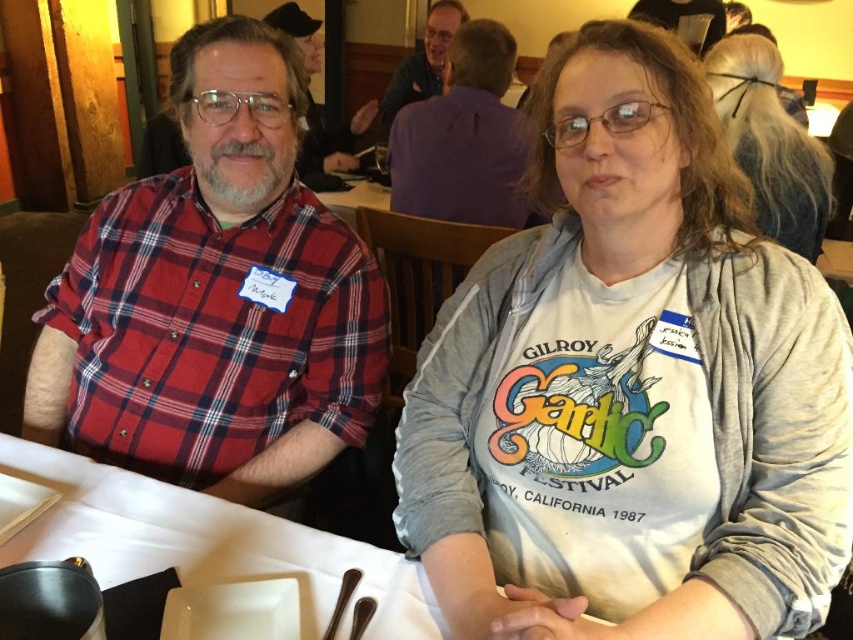
Is gray fleece jacket at upper center to the right of green fabric shirt at upper center from the viewer's perspective?

No, gray fleece jacket at upper center is not to the right of green fabric shirt at upper center.

From the picture: Between gray fleece jacket at upper center and green fabric shirt at upper center, which one appears on the left side from the viewer's perspective?

gray fleece jacket at upper center is more to the left.

The width and height of the screenshot is (853, 640). Describe the element at coordinates (331, 140) in the screenshot. I see `gray fleece jacket at upper center` at that location.

Locate an element on the screen. The height and width of the screenshot is (640, 853). gray fleece jacket at upper center is located at coordinates (331, 140).

Which of these two, white glossy plate at lower center or polished metal spoon at lower center, stands shorter?

Standing shorter between the two is polished metal spoon at lower center.

Which is more to the right, white glossy plate at lower center or polished metal spoon at lower center?

From the viewer's perspective, polished metal spoon at lower center appears more on the right side.

Find the location of a particular element. Image resolution: width=853 pixels, height=640 pixels. white glossy plate at lower center is located at coordinates (233, 611).

Is white ceramic plate at center smaller than polished metal spoon at lower center?

Actually, white ceramic plate at center might be larger than polished metal spoon at lower center.

Which is below, white ceramic plate at center or polished metal spoon at lower center?

polished metal spoon at lower center is lower down.

Who is more forward, (x=410, y=582) or (x=368, y=609)?

Point (x=368, y=609)

Identify the location of white ceramic plate at center. (206, 541).